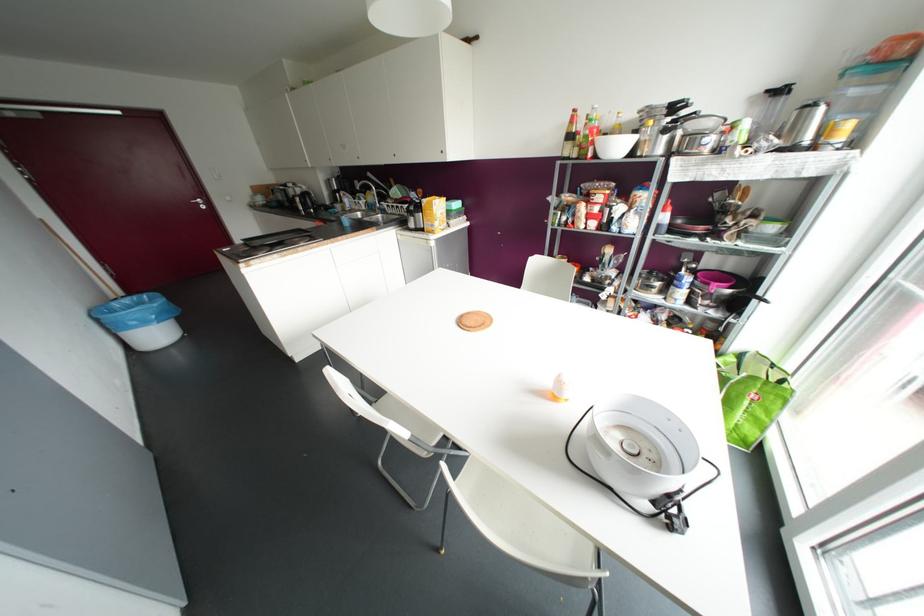
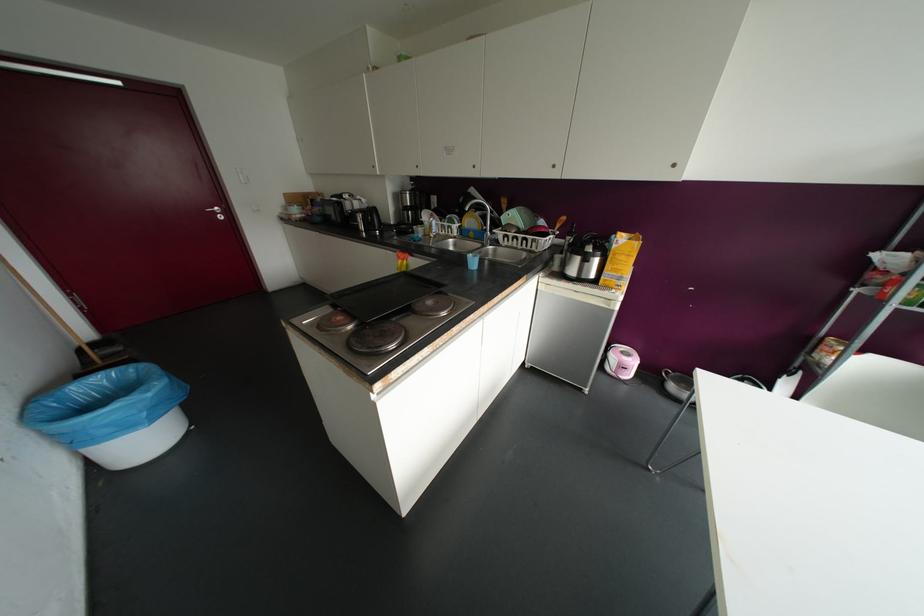
Where in the second image is the point corresponding to pixel 127 300 from the first image?

(100, 379)